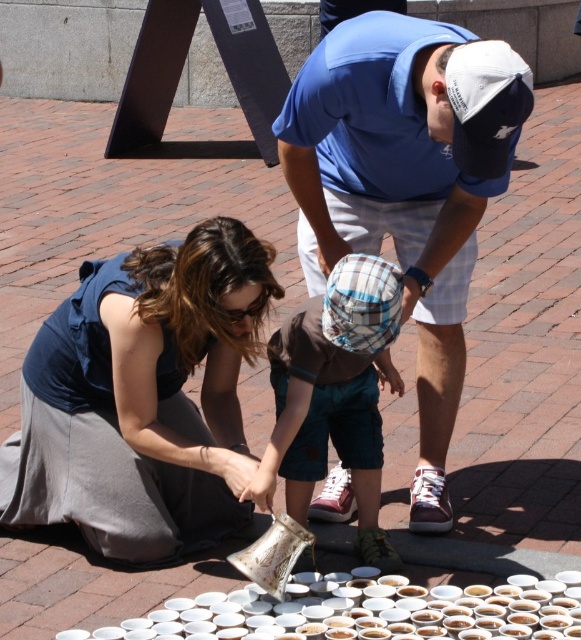
From the picture: You are a photographer taking a picture of the two adults and the child. The blue cotton shirt at center and the brown cotton shirt at center are both in the frame. Which adult should stand closer to the camera to ensure both shirts are visible in the photo?

The blue cotton shirt at center is taller than the brown cotton shirt at center, so the adult wearing the brown cotton shirt at center should stand closer to the camera to ensure both shirts are visible in the photo.

You are a photographer trying to capture a candid shot of the blue fabric dress at lower left and the blue cotton shirt at center. Since you want to ensure both subjects are in focus, you need to know which one is closer to the camera. Can you determine which is nearer?

The blue fabric dress at lower left is shorter than the blue cotton shirt at center, so the blue fabric dress at lower left is closer to the camera.

You are standing at the origin point of the coordinate system. You want to walk to the blue fabric dress at lower left. Which direction should you go?

The blue fabric dress at lower left is located at coordinate point 0.622 on the x axis and 0.246 on the y axis. Since you are at the origin, you should move towards the positive x and positive y direction to reach the blue fabric dress at lower left.